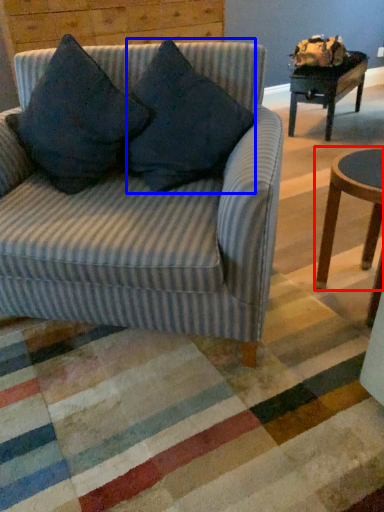
Question: Which of the following is the farthest to the observer, coffee table (highlighted by a red box) or throw pillow (highlighted by a blue box)?

Choices:
 (A) coffee table
 (B) throw pillow

Answer: (A)